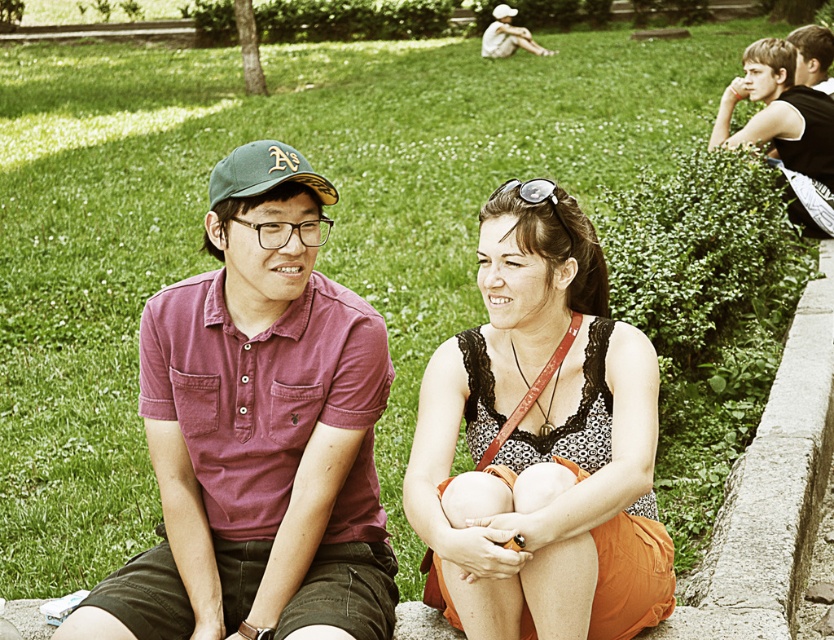
Who is more forward, (491, 604) or (235, 157)?

Positioned in front is point (491, 604).

The width and height of the screenshot is (834, 640). What are the coordinates of `orange lace dress at center` in the screenshot? It's located at (541, 442).

The width and height of the screenshot is (834, 640). I want to click on orange lace dress at center, so click(x=541, y=442).

Can you confirm if matte cotton polo shirt at center is wider than green fabric baseball cap at left?

Indeed, matte cotton polo shirt at center has a greater width compared to green fabric baseball cap at left.

Can you confirm if matte cotton polo shirt at center is smaller than green fabric baseball cap at left?

No, matte cotton polo shirt at center is not smaller than green fabric baseball cap at left.

Locate an element on the screen. The width and height of the screenshot is (834, 640). matte cotton polo shirt at center is located at coordinates (259, 432).

Image resolution: width=834 pixels, height=640 pixels. Identify the location of matte cotton polo shirt at center. (x=259, y=432).

Does matte cotton polo shirt at center appear on the left side of orange lace dress at center?

Correct, you'll find matte cotton polo shirt at center to the left of orange lace dress at center.

Is matte cotton polo shirt at center thinner than orange lace dress at center?

In fact, matte cotton polo shirt at center might be wider than orange lace dress at center.

Between point (274, 140) and point (590, 579), which one is positioned behind?

Point (274, 140)

Locate an element on the screen. The width and height of the screenshot is (834, 640). matte cotton polo shirt at center is located at coordinates coord(259,432).